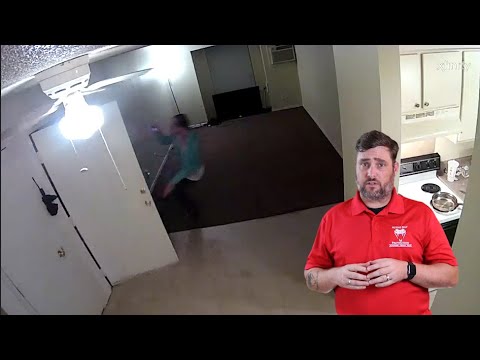
The image size is (480, 360). Find the location of `dark carpet`. dark carpet is located at coordinates (254, 166).